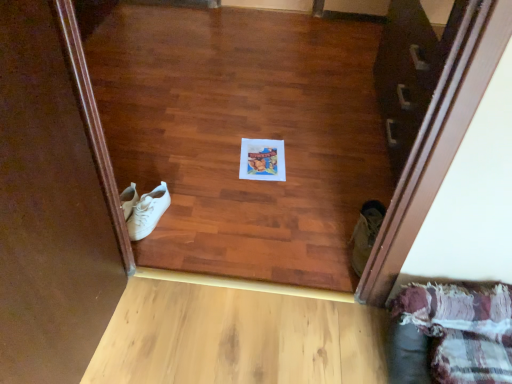
Question: Is light wood plank at lower center to the right of plaid fabric couch at lower right from the viewer's perspective?

Choices:
 (A) no
 (B) yes

Answer: (A)

Question: Does light wood plank at lower center come in front of plaid fabric couch at lower right?

Choices:
 (A) yes
 (B) no

Answer: (B)

Question: Can you confirm if light wood plank at lower center is wider than plaid fabric couch at lower right?

Choices:
 (A) yes
 (B) no

Answer: (A)

Question: Is light wood plank at lower center aimed at plaid fabric couch at lower right?

Choices:
 (A) yes
 (B) no

Answer: (B)

Question: Would you say light wood plank at lower center is outside plaid fabric couch at lower right?

Choices:
 (A) no
 (B) yes

Answer: (B)

Question: Considering their positions, is white leather sneakers at left, acting as the 2th footwear starting from the right, located in front of or behind white paper at center?

Choices:
 (A) behind
 (B) front

Answer: (B)

Question: From a real-world perspective, is white leather sneakers at left, placed as the 1th footwear when sorted from left to right, above or below white paper at center?

Choices:
 (A) below
 (B) above

Answer: (B)

Question: Visually, is white leather sneakers at left, acting as the 2th footwear starting from the right, positioned to the left or to the right of white paper at center?

Choices:
 (A) left
 (B) right

Answer: (A)

Question: Looking at the image, does white leather sneakers at left, placed as the 1th footwear when sorted from left to right, seem bigger or smaller compared to white paper at center?

Choices:
 (A) small
 (B) big

Answer: (B)

Question: In terms of height, does white paper at center look taller or shorter compared to light wood plank at lower center?

Choices:
 (A) tall
 (B) short

Answer: (B)

Question: In terms of width, does white paper at center look wider or thinner when compared to light wood plank at lower center?

Choices:
 (A) wide
 (B) thin

Answer: (B)

Question: From the image's perspective, relative to light wood plank at lower center, is white paper at center above or below?

Choices:
 (A) above
 (B) below

Answer: (A)

Question: In the image, is white paper at center on the left side or the right side of light wood plank at lower center?

Choices:
 (A) left
 (B) right

Answer: (B)

Question: Is white leather sneakers at left, placed as the 1th footwear when sorted from left to right, bigger or smaller than light wood plank at lower center?

Choices:
 (A) small
 (B) big

Answer: (A)

Question: Is white leather sneakers at left, acting as the 2th footwear starting from the right, spatially inside light wood plank at lower center, or outside of it?

Choices:
 (A) outside
 (B) inside

Answer: (A)